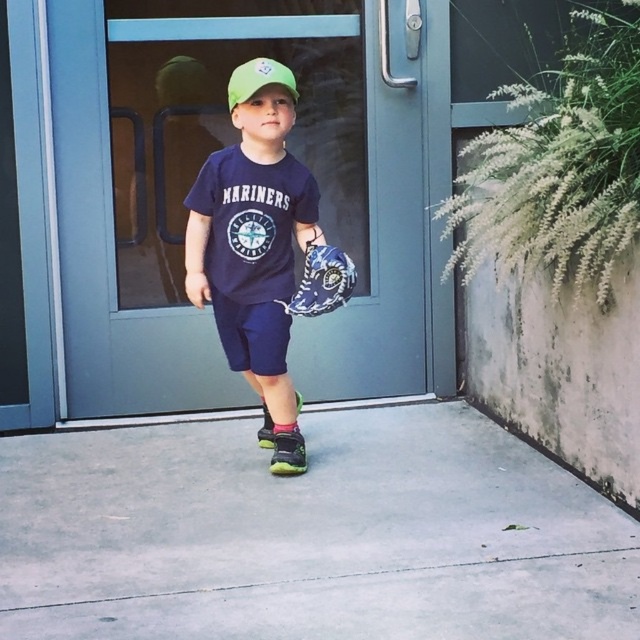
You are a photographer trying to capture the child in the image. You want to ensure both the matte blue shorts at center and the green matte baseball cap at center are clearly visible in the photo. Based on their positions, which object might be partially hidden if you focus on the other?

The green matte baseball cap at center is behind matte blue shorts at center, so if you focus on the shorts, the cap might be partially hidden. Conversely, focusing on the cap could obscure part of the shorts.

You are a fashion designer looking at the child in the image. The child is wearing a navy blue Mariners t shirt, navy blue shorts, and green sneakers. You notice the matte blue shorts at center and the green matte baseball cap at center. Which clothing item is located lower on the child?

The matte blue shorts at center is positioned under the green matte baseball cap at center, so the shorts are lower on the child.

The child is holding the blue fabric baseball glove at center in their hand. If the child wants to place the glove on the ground next to their matte blue shorts at center, will the glove be taller or shorter than the shorts when viewed from the front?

The blue fabric baseball glove at center is shorter than the matte blue shorts at center because the matte blue shorts at center is much taller as blue fabric baseball glove at center.